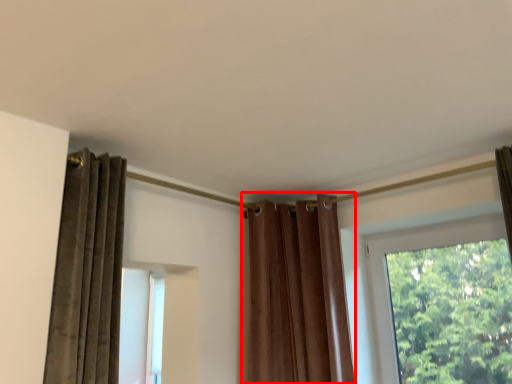
Question: Considering the relative positions of curtain (annotated by the red box) and window in the image provided, where is curtain (annotated by the red box) located with respect to the staircase?

Choices:
 (A) right
 (B) left

Answer: (B)